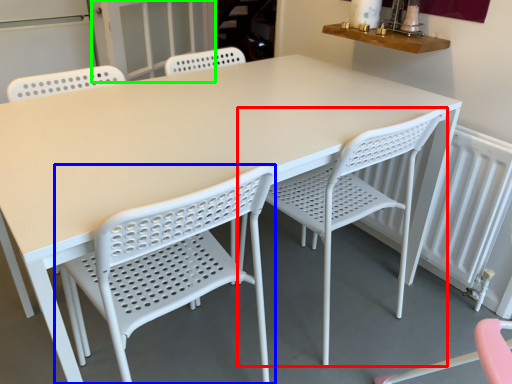
Question: Based on their relative distances, which object is nearer to chair (highlighted by a red box)? Choose from chair (highlighted by a blue box) and screen door (highlighted by a green box).

Choices:
 (A) chair
 (B) screen door

Answer: (A)